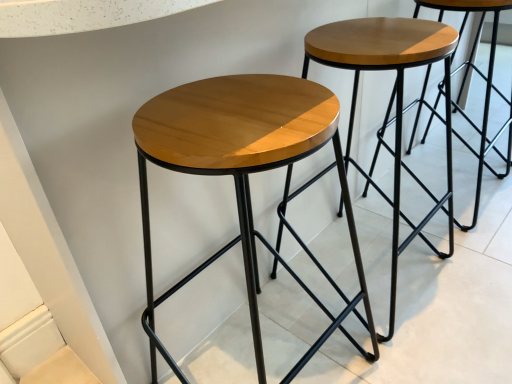
Question: Is wooden stool at center, placed as the first stool when sorted from right to left, taller or shorter than shiny wood stool at center, which ranks as the 1th stool in left-to-right order?

Choices:
 (A) tall
 (B) short

Answer: (B)

Question: Choose the correct answer: Is wooden stool at center, placed as the first stool when sorted from right to left, inside shiny wood stool at center, acting as the second stool starting from the right, or outside it?

Choices:
 (A) inside
 (B) outside

Answer: (B)

Question: Considering the positions of wooden stool at center, the 2th stool in the left-to-right sequence, and shiny wood stool at center, which ranks as the 1th stool in left-to-right order, in the image, is wooden stool at center, the 2th stool in the left-to-right sequence, wider or thinner than shiny wood stool at center, which ranks as the 1th stool in left-to-right order,?

Choices:
 (A) wide
 (B) thin

Answer: (B)

Question: Is point (209, 140) positioned closer to the camera than point (452, 44)?

Choices:
 (A) farther
 (B) closer

Answer: (B)

Question: From a real-world perspective, is shiny wood stool at center, which ranks as the 1th stool in left-to-right order, positioned above or below wooden stool at center, placed as the first stool when sorted from right to left?

Choices:
 (A) below
 (B) above

Answer: (B)

Question: From the image's perspective, is shiny wood stool at center, which ranks as the 1th stool in left-to-right order, located above or below wooden stool at center, the 2th stool in the left-to-right sequence?

Choices:
 (A) below
 (B) above

Answer: (A)

Question: Is shiny wood stool at center, which ranks as the 1th stool in left-to-right order, bigger or smaller than wooden stool at center, the 2th stool in the left-to-right sequence?

Choices:
 (A) big
 (B) small

Answer: (A)